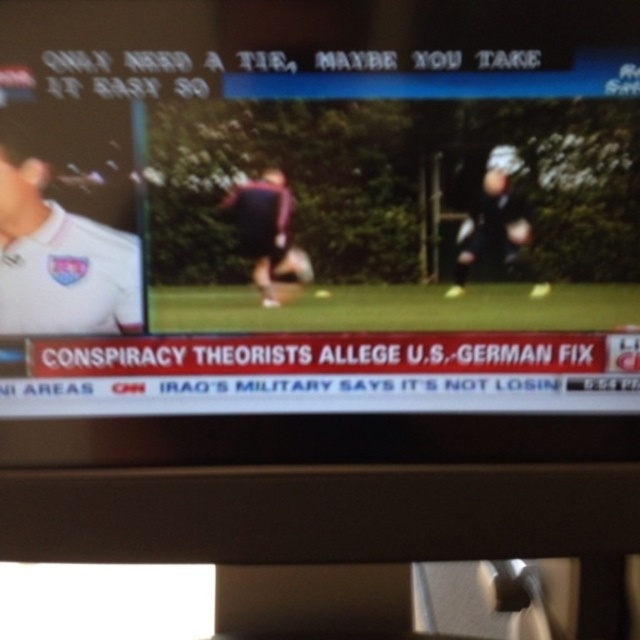
You are a sports analyst watching the split screen. On the left, you see the maroon jersey at center and on the right, the dark blue uniform at right. Which of these two has a smaller height in their respective screen sides?

The maroon jersey at center has a lesser height compared to dark blue uniform at right, so the maroon jersey at center is smaller in height.

You are a sports analyst watching the split screen broadcast. On the left side, there is a close up of a person wearing a white sports jersey with a logo on the chest. On the right side, there is a wider shot of a soccer field with two individuals. The point at coordinates (264, 228) is marked on the screen. Which object does this point correspond to?

The point at coordinates (264, 228) corresponds to the maroon jersey at center.

You are watching a soccer match on TV and notice the split screen showing a close up of the white matte shirt at left and a wider shot of the dark blue uniform at right. Which player appears bigger on the screen?

The white matte shirt at left appears bigger on the screen because its width is larger than the dark blue uniform at right.